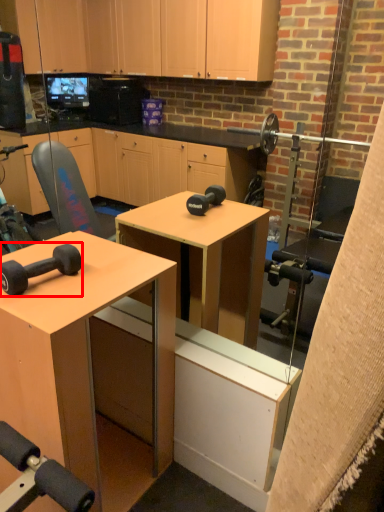
Question: From the image's perspective, what is the correct spatial relationship of dumbbell (annotated by the red box) in relation to desk?

Choices:
 (A) above
 (B) below

Answer: (A)